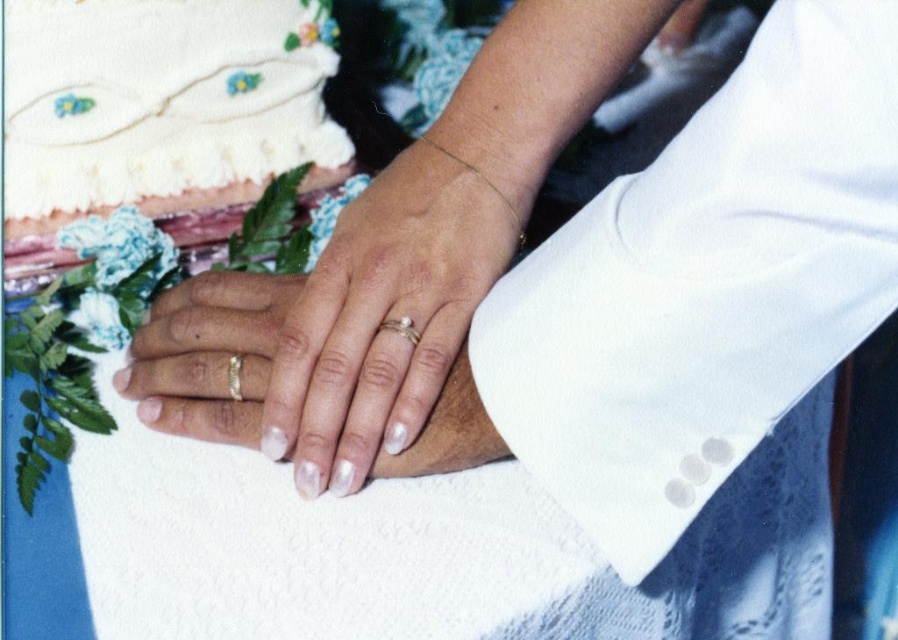
Question: Which object is closer to the camera taking this photo?

Choices:
 (A) white matte ring at center
 (B) silver metallic ring at center
 (C) gold metallic ring at center

Answer: (C)

Question: Considering the real-world distances, which object is farthest from the gold metallic ring at center?

Choices:
 (A) silver metallic ring at center
 (B) white matte ring at center
 (C) white frosted cake at upper left

Answer: (C)

Question: From the image, what is the correct spatial relationship of white frosted cake at upper left in relation to white matte ring at center?

Choices:
 (A) above
 (B) below

Answer: (A)

Question: Which point is closer to the camera taking this photo?

Choices:
 (A) (232, 346)
 (B) (452, 184)
 (C) (181, 220)
 (D) (239, 371)

Answer: (D)

Question: Is the position of white frosted cake at upper left less distant than that of gold metallic ring at center?

Choices:
 (A) yes
 (B) no

Answer: (B)

Question: Does white frosted cake at upper left have a larger size compared to silver metallic ring at center?

Choices:
 (A) yes
 (B) no

Answer: (A)